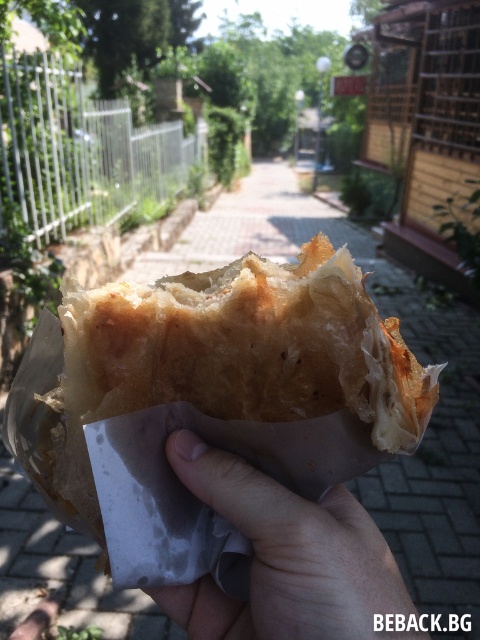
In the scene shown: You are standing at point (408, 636) and want to walk to point (165, 296). Given that the path between them is clear, will you be moving towards or away from the hand holding the pastry?

Since point (165, 296) is behind point (408, 636), moving from point (408, 636) to point (165, 296) means you are moving towards the hand holding the pastry.

Looking at this image, you are a food critic evaluating the presentation of the golden crispy pastry at center and the light skin textured hand at center. Which object is wider in the image?

The golden crispy pastry at center is wider than the light skin textured hand at center.

You are a food critic observing the golden crispy pastry at center and the light skin textured hand at center. Which object is taller in the image?

The golden crispy pastry at center is taller than the light skin textured hand at center.